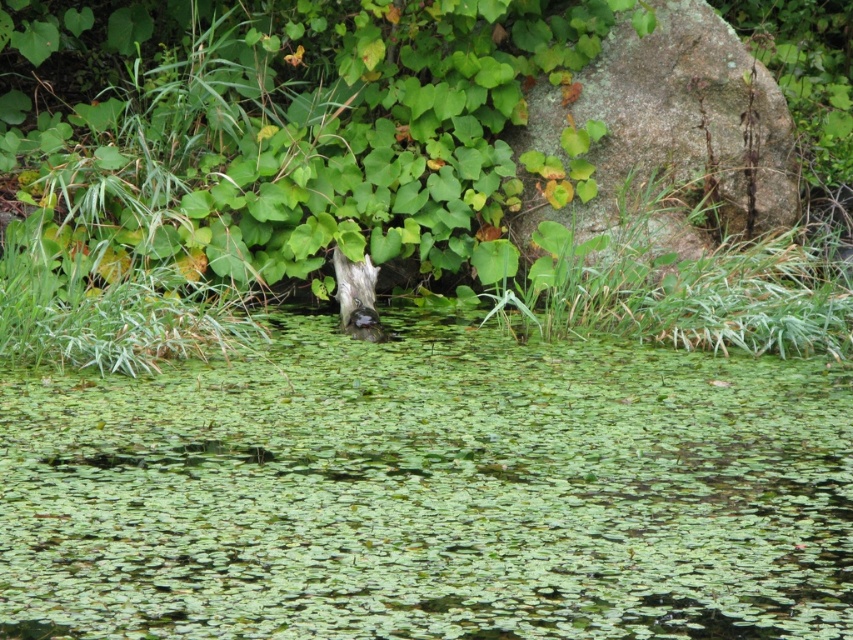
You are a hiker trying to cross from the left side to the right side of the image. The green leafy water at center and the gray mossy rock at upper right are in your path. Which obstacle is shorter and easier to step over?

The green leafy water at center is not as tall as the gray mossy rock at upper right, so it is shorter and easier to step over.

You are standing at the origin point of the coordinate system. You want to reach the green leafy water at center. Which direction should you move in to get there?

The green leafy water at center is located at coordinate point 0.769 on the x axis and 0.504 on the y axis. Since you are at the origin point, you should move towards the positive x and y directions to reach it.

You are standing at the point with coordinates point (703, 150) and want to walk towards the point (730, 464). According to the scene description, will you be moving towards the foreground or background?

Answer: Since point (730, 464) is in front of point (703, 150), moving towards it means you are moving towards the foreground.